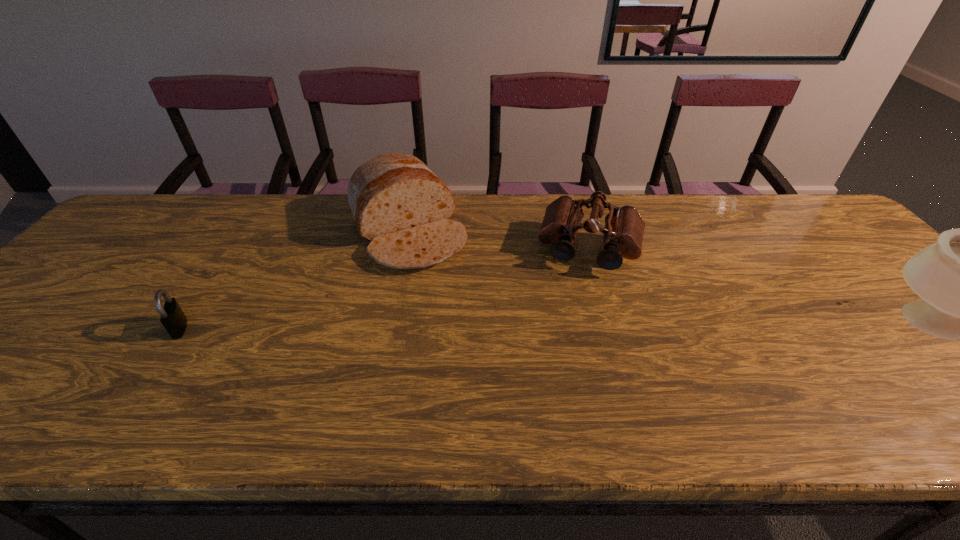
Where is `vacant space located at the sliced end of the second object from left to right`? The height and width of the screenshot is (540, 960). vacant space located at the sliced end of the second object from left to right is located at coordinates (444, 298).

At what (x,y) coordinates should I click in order to perform the action: click on free space located at the sliced end of the second object from left to right. Please return your answer as a coordinate pair (x, y). This screenshot has width=960, height=540. Looking at the image, I should click on (468, 340).

Where is `free space located at the sliced end of the second object from left to right`? The width and height of the screenshot is (960, 540). free space located at the sliced end of the second object from left to right is located at coordinates [x=494, y=384].

Identify the location of binoculars at the far edge. This screenshot has height=540, width=960. (624, 227).

This screenshot has width=960, height=540. Find the location of `bread at the far edge`. bread at the far edge is located at coordinates (399, 205).

Identify the location of vacant region at the far edge of the desktop. The width and height of the screenshot is (960, 540). (313, 206).

This screenshot has width=960, height=540. I want to click on free region at the near edge of the desktop, so click(413, 373).

In the image, there is a desktop. Identify the location of vacant space at the far left corner. The image size is (960, 540). (138, 223).

Identify the location of vacant space at the far right corner. (766, 200).

Identify the location of vacant position at the near right corner of the desktop. Image resolution: width=960 pixels, height=540 pixels. (937, 388).